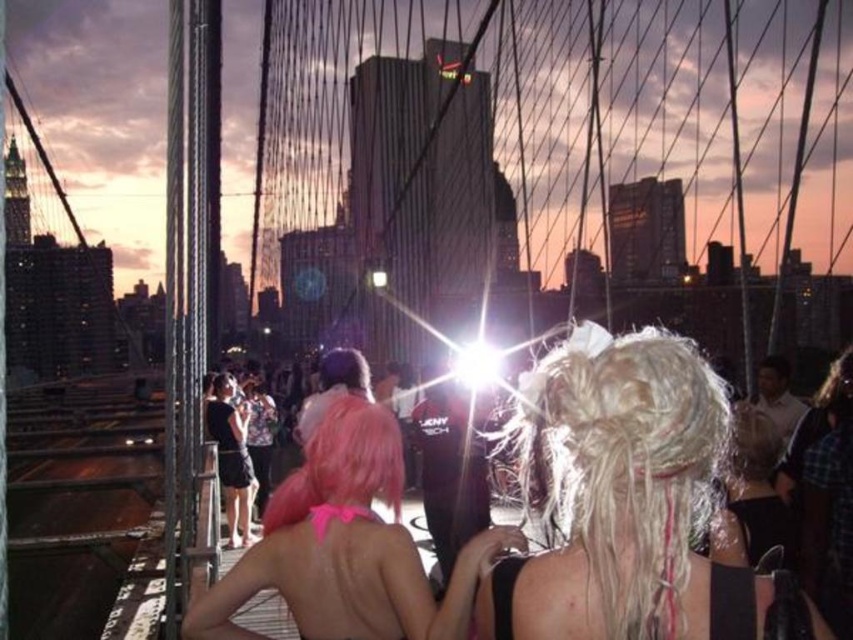
You are standing on the Brooklyn Bridge during sunset and want to take a photo of two specific points. The first point is at coordinates point [386,561] and the second is at point [329,442]. Which point should you focus on first if you want to capture the one that appears closer to you in the photo?

Point [386,561] is closer to the camera than point [329,442], so you should focus on point [386,561] first to capture the one that appears closer in the photo.

Based on the photo, you are a photographer trying to capture a closeup shot of the pink matte wig at center and the pink matte hair at center. Since you want both to be clearly visible, which one should you focus on to ensure it appears larger in your photo?

The pink matte wig at center is larger in size than the pink matte hair at center, so focusing on the pink matte wig at center will ensure it appears larger in the photo.

You are a photographer aiming to capture a shot of the two people with blonde hair at center and pink matte hair at center. Since the sunlight is causing a lens flare, which person should you position closer to the light source to avoid overexposure?

The blonde hair at center has a greater height compared to pink matte hair at center, so positioning the taller blonde hair at center closer to the light source would help avoid overexposure as it can block some of the direct sunlight.